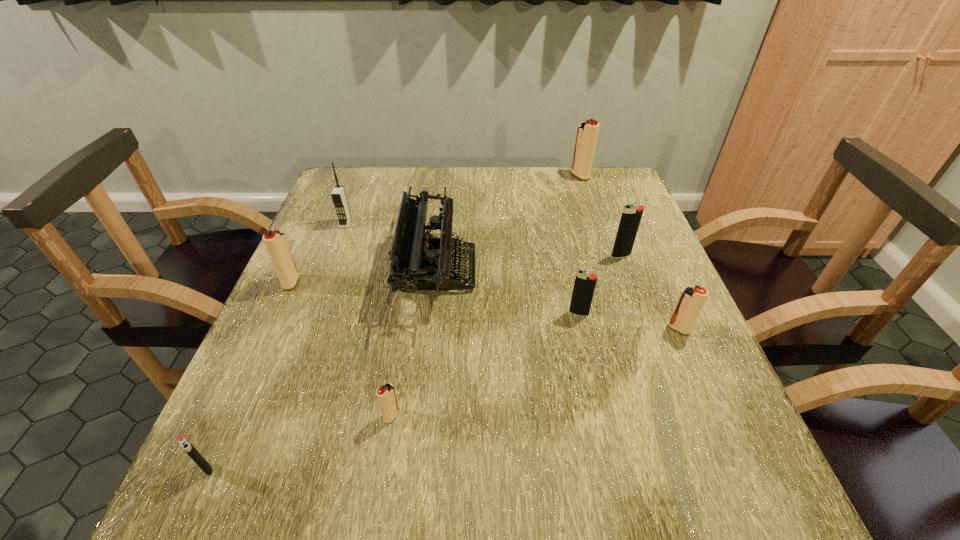
At what (x,y) coordinates should I click in order to perform the action: click on vacant space located on the typing side of the typewriter. Please return your answer as a coordinate pair (x, y). Looking at the image, I should click on (625, 270).

The width and height of the screenshot is (960, 540). I want to click on vacant region located on the front of the fourth igniter from left to right, so click(598, 400).

Identify the location of blank space located 0.240m on the front of the rightmost red igniter. Image resolution: width=960 pixels, height=540 pixels. (731, 450).

Where is `vacant space located 0.050m on the back of the nearest red igniter`? This screenshot has height=540, width=960. vacant space located 0.050m on the back of the nearest red igniter is located at coordinates click(x=396, y=383).

You are a GUI agent. You are given a task and a screenshot of the screen. Output one action in this format:
    pyautogui.click(x=<x>, y=<y>)
    Task: Click on the vacant point located on the right of the smallest black igniter
    This screenshot has width=960, height=540.
    Given the screenshot: What is the action you would take?
    click(x=342, y=468)

The image size is (960, 540). I want to click on object located at the far edge, so click(x=587, y=133).

In order to click on object that is positioned at the near edge in this screenshot , I will do `click(184, 443)`.

You are a GUI agent. You are given a task and a screenshot of the screen. Output one action in this format:
    pyautogui.click(x=<x>, y=<y>)
    Task: Click on the cellular telephone that is at the left edge
    Image resolution: width=960 pixels, height=540 pixels.
    Given the screenshot: What is the action you would take?
    pyautogui.click(x=338, y=195)

At what (x,y) coordinates should I click in order to perform the action: click on object present at the near left corner. Please return your answer as a coordinate pair (x, y). This screenshot has height=540, width=960. Looking at the image, I should click on pos(184,443).

Locate an element on the screen. object at the far right corner is located at coordinates (587, 133).